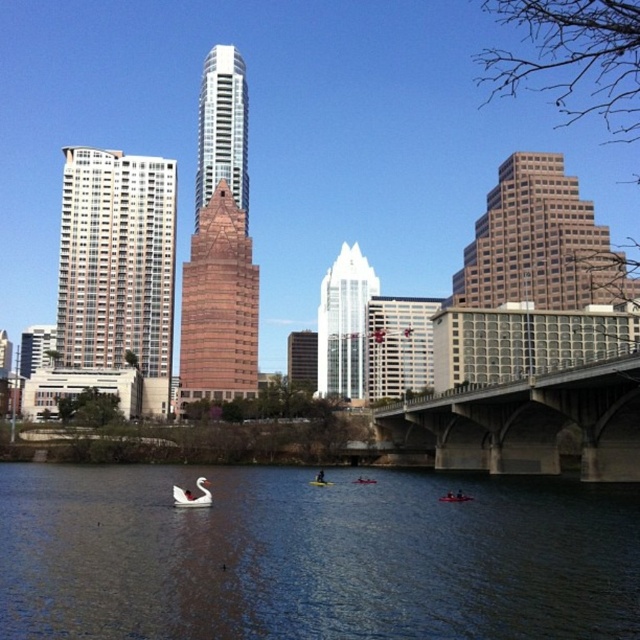
Question: Can you confirm if smooth dark water at lower center is positioned to the left of red plastic kayak at center?

Choices:
 (A) no
 (B) yes

Answer: (B)

Question: Estimate the real-world distances between objects in this image. Which object is farther from the orange plastic kayak at lower center?

Choices:
 (A) white matte swan at lower center
 (B) smooth dark water at lower center
 (C) concrete bridge at center

Answer: (A)

Question: Can you confirm if concrete bridge at center is positioned to the left of white matte swan at lower center?

Choices:
 (A) no
 (B) yes

Answer: (A)

Question: Which object is the closest to the concrete bridge at center?

Choices:
 (A) smooth dark water at lower center
 (B) orange plastic kayak at lower center
 (C) white matte swan at lower center

Answer: (B)

Question: Can you confirm if concrete bridge at center is positioned to the right of orange plastic kayak at lower center?

Choices:
 (A) yes
 (B) no

Answer: (A)

Question: Which point is closer to the camera taking this photo?

Choices:
 (A) (440, 499)
 (B) (525, 381)

Answer: (A)